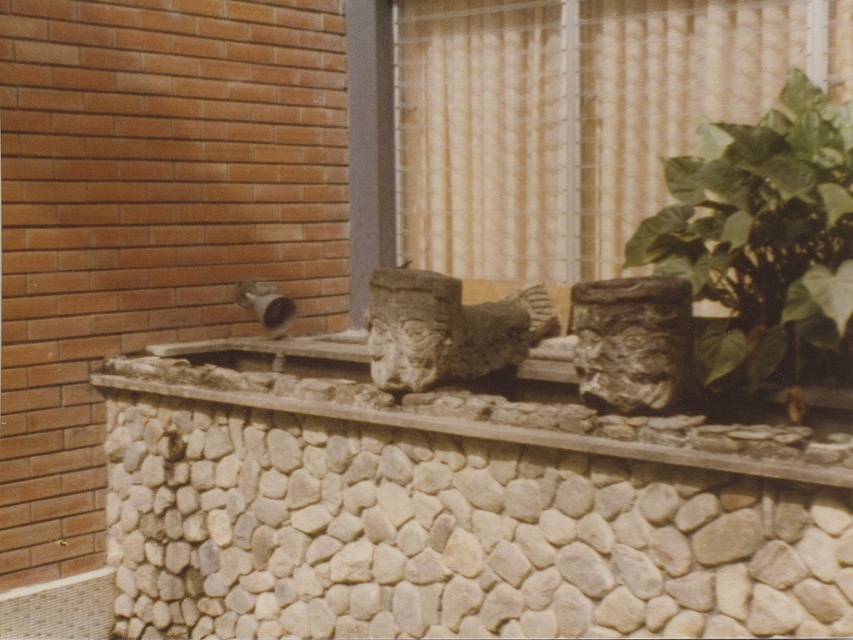
You are standing in front of the wall with the decorative arrangement. You want to know if you can reach the green leafy plant at right without moving your position. Your maximum reaching distance is 8 feet. Can you reach it?

The green leafy plant at right is 8.88 feet away from the camera, which is beyond your maximum reaching distance of 8 feet. Therefore, you cannot reach it without moving.

You are standing in front of the wall and window described. If you want to touch the matte stone wall at center, would you have to go through the matte glass window at center first?

A: The matte stone wall at center is behind the matte glass window at center, so you would have to go through the matte glass window at center to reach it.